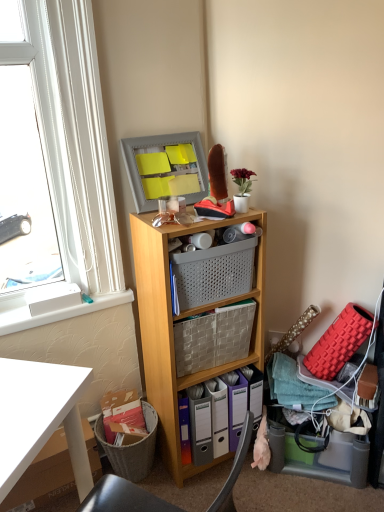
Where is `free space above white plastic window sill at upper left (from a real-world perspective)`? Image resolution: width=384 pixels, height=512 pixels. free space above white plastic window sill at upper left (from a real-world perspective) is located at coordinates (57, 303).